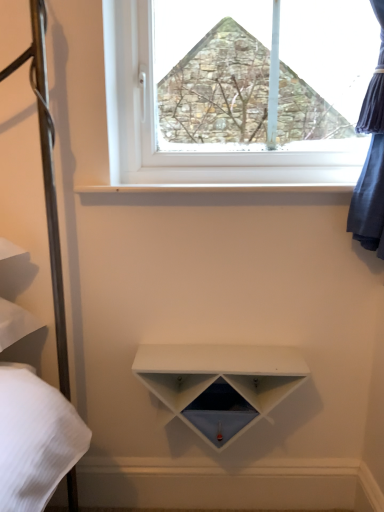
Question: Can you confirm if white plastic window at upper center is bigger than white matte shelf at center?

Choices:
 (A) no
 (B) yes

Answer: (B)

Question: Is white plastic window at upper center looking in the opposite direction of white matte shelf at center?

Choices:
 (A) yes
 (B) no

Answer: (B)

Question: From a real-world perspective, is white plastic window at upper center positioned over white matte shelf at center based on gravity?

Choices:
 (A) no
 (B) yes

Answer: (B)

Question: Can you confirm if white plastic window at upper center is shorter than white matte shelf at center?

Choices:
 (A) yes
 (B) no

Answer: (B)

Question: Is white plastic window at upper center completely or partially outside of white matte shelf at center?

Choices:
 (A) yes
 (B) no

Answer: (A)

Question: In terms of width, does white plastic window at upper center look wider or thinner when compared to white matte shelf at center?

Choices:
 (A) wide
 (B) thin

Answer: (B)

Question: From the image's perspective, is white plastic window at upper center above or below white matte shelf at center?

Choices:
 (A) above
 (B) below

Answer: (A)

Question: Considering the positions of white plastic window at upper center and white matte shelf at center in the image, is white plastic window at upper center taller or shorter than white matte shelf at center?

Choices:
 (A) short
 (B) tall

Answer: (B)

Question: Is white plastic window at upper center to the left or to the right of white matte shelf at center in the image?

Choices:
 (A) right
 (B) left

Answer: (A)

Question: In terms of height, does white smooth shelf at upper center look taller or shorter compared to white plastic window at upper center?

Choices:
 (A) tall
 (B) short

Answer: (B)

Question: Is white smooth shelf at upper center in front of or behind white plastic window at upper center in the image?

Choices:
 (A) front
 (B) behind

Answer: (A)

Question: From a real-world perspective, is white smooth shelf at upper center positioned above or below white plastic window at upper center?

Choices:
 (A) above
 (B) below

Answer: (B)

Question: From the image's perspective, is white smooth shelf at upper center positioned above or below white plastic window at upper center?

Choices:
 (A) above
 (B) below

Answer: (B)

Question: Based on their sizes in the image, would you say white matte shelf at center is bigger or smaller than white plastic window at upper center?

Choices:
 (A) big
 (B) small

Answer: (B)

Question: Relative to white plastic window at upper center, is white matte shelf at center in front or behind?

Choices:
 (A) behind
 (B) front

Answer: (B)